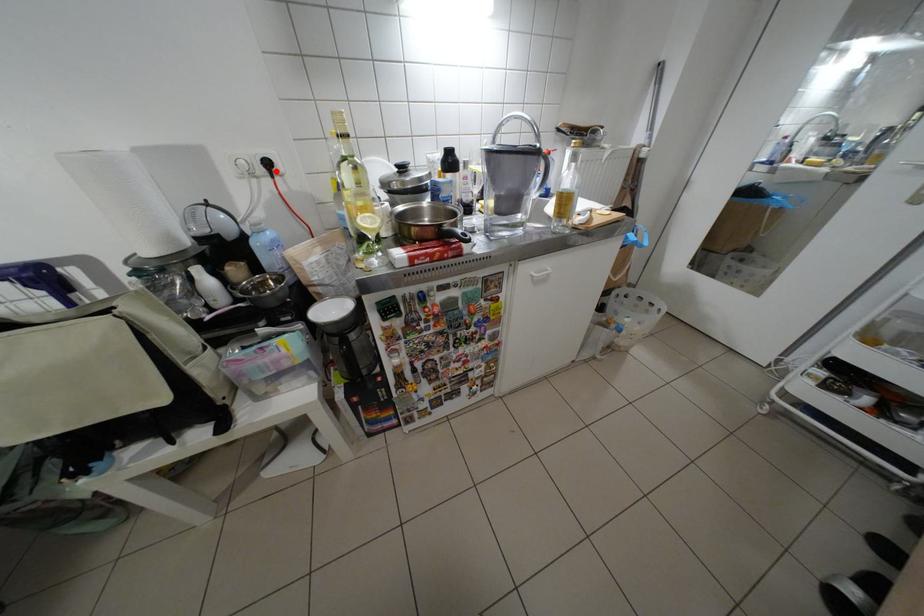
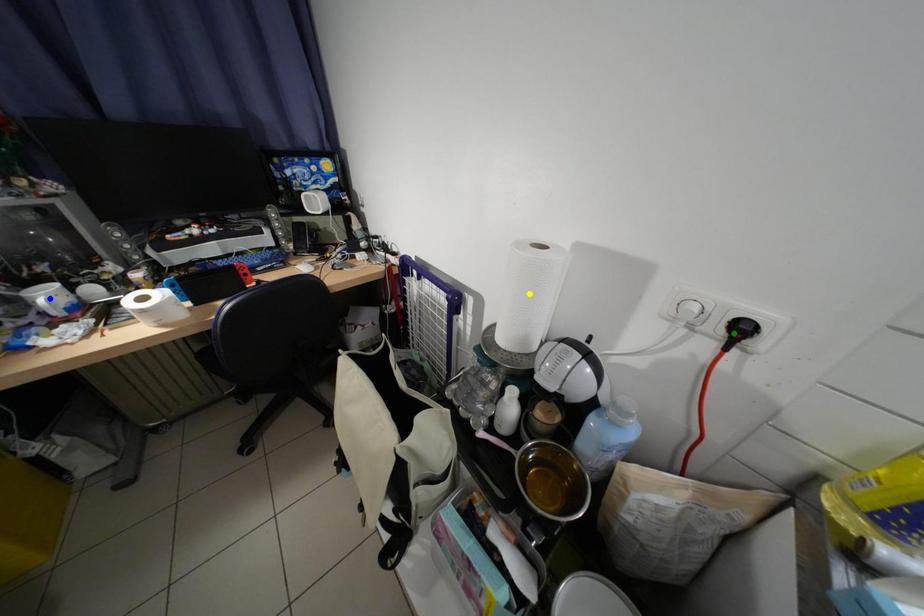
Question: I am providing you with two images of the same scene from different viewpoints. A red point is marked on the first image. You are given multiple points on the second image. In image 2, which mark is for the same physical point as the one in image 1?

Choices:
 (A) green point
 (B) blue point
 (C) yellow point

Answer: (A)